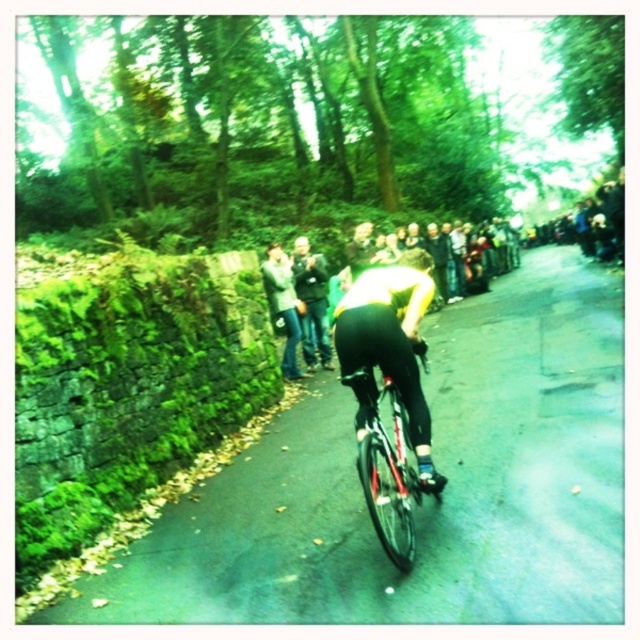
You are a cyclist on a narrow road with a stone wall on your left. You notice two points marked on the road ahead. One is at point (380,401) and the other at point (273,275). Which point is closer to your current position?

Point (273,275) is closer to your current position because it is behind point (380,401), which is further ahead.

You are a photographer positioned on the side of the road. You want to capture a photo of the cyclist while ensuring both the shiny metallic bicycle at center and the jeans at center are clearly visible in the frame. Based on their positions, which object should you focus on first to ensure both are in focus?

The shiny metallic bicycle at center is to the right of jeans at center. To ensure both are in focus, you should focus on the jeans at center first since it is closer to the photographer, and then adjust to include the bicycle at the edge of the focus range.